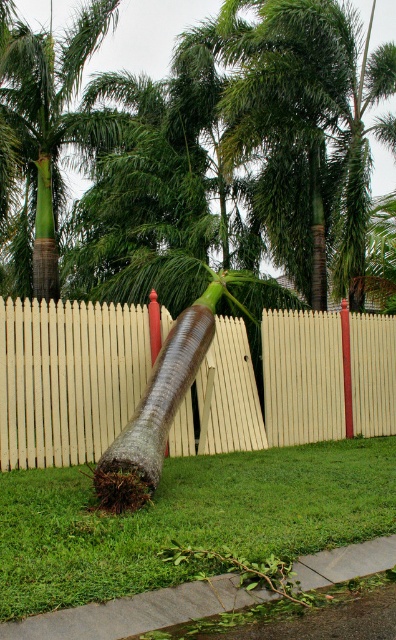
From the picture: You are a gardener who needs to mow the lawn. You are standing at the position where the green grass at lower center is located. The white wood fence at center is in your way. Can you mow the grass near the fence without hitting it?

The distance between the white wood fence at center and green grass at lower center is 3.88 meters, which is a safe distance for mowing. You can mow the grass near the fence without hitting it.

You are standing in the garden where the palm tree fell. There are two points marked on the fallen tree trunk. One is at coordinate point (74, 500) and the other at point (190, 589). Which of these two points is closer to you?

Point (74, 500) is closer to you because it is further to the viewer than point (190, 589).